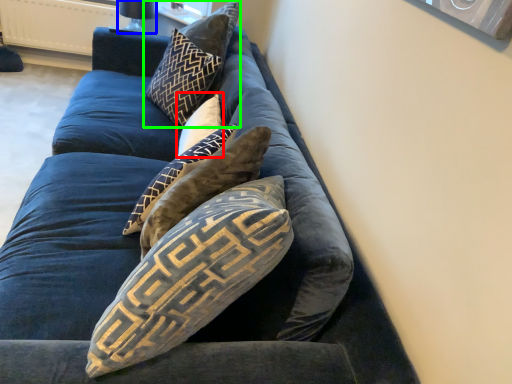
Question: Considering the real-world distances, which object is farthest from pillow (highlighted by a red box)? lamp (highlighted by a blue box) or pillow (highlighted by a green box)?

Choices:
 (A) lamp
 (B) pillow

Answer: (A)